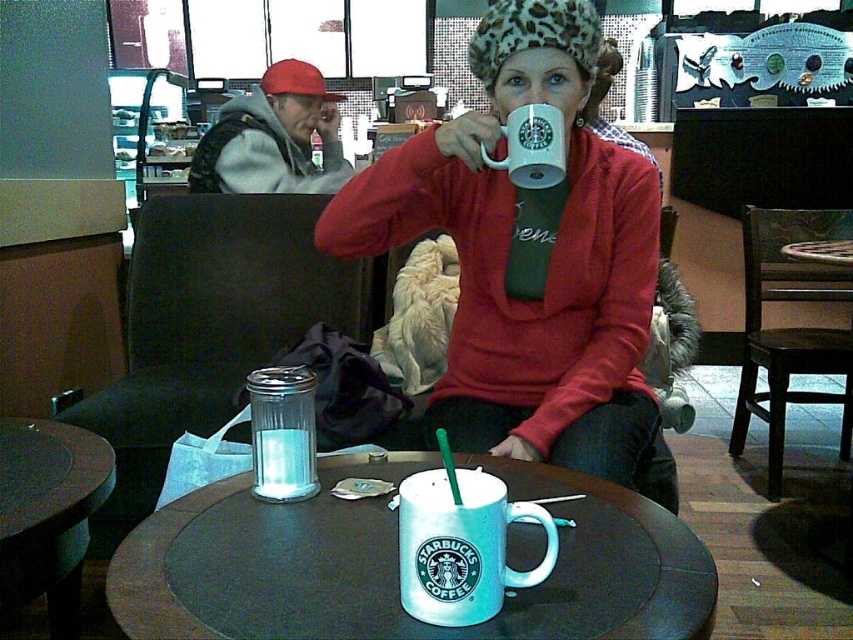
Question: Which point is farther to the camera?

Choices:
 (A) (300, 161)
 (B) (489, 611)
 (C) (392, 182)

Answer: (A)

Question: Can you confirm if metallic silver cup at center is positioned to the left of clear plastic shaker at center?

Choices:
 (A) no
 (B) yes

Answer: (A)

Question: Does metallic silver cup at center have a greater width compared to white matte mug at center?

Choices:
 (A) no
 (B) yes

Answer: (B)

Question: Which of the following is the farthest from the observer?

Choices:
 (A) metallic silver cup at center
 (B) matte white mug at center
 (C) white matte mug at center
 (D) clear plastic shaker at center

Answer: (B)

Question: Does matte white mug at center appear under clear plastic shaker at center?

Choices:
 (A) no
 (B) yes

Answer: (A)

Question: Considering the real-world distances, which object is closest to the frosted glass mug at center?

Choices:
 (A) clear plastic shaker at center
 (B) white matte mug at center

Answer: (A)